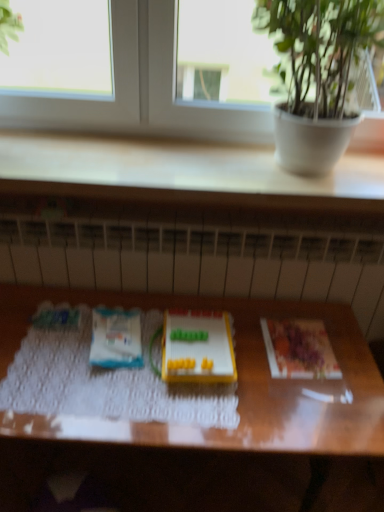
The height and width of the screenshot is (512, 384). Find the location of `vacant space to the left of printed paper at right, which appears as the first paperback book when viewed from the right`. vacant space to the left of printed paper at right, which appears as the first paperback book when viewed from the right is located at coordinates (239, 344).